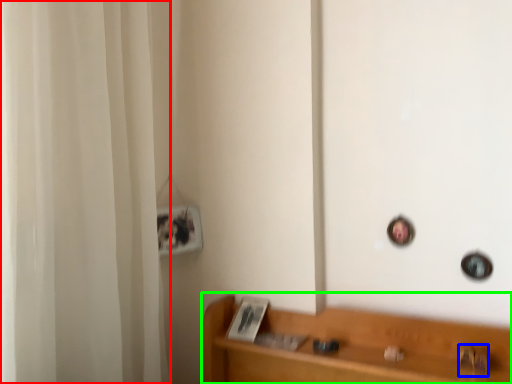
Question: Which is nearer to the shower curtain (highlighted by a red box)? door handle (highlighted by a blue box) or furniture (highlighted by a green box).

Choices:
 (A) door handle
 (B) furniture

Answer: (B)